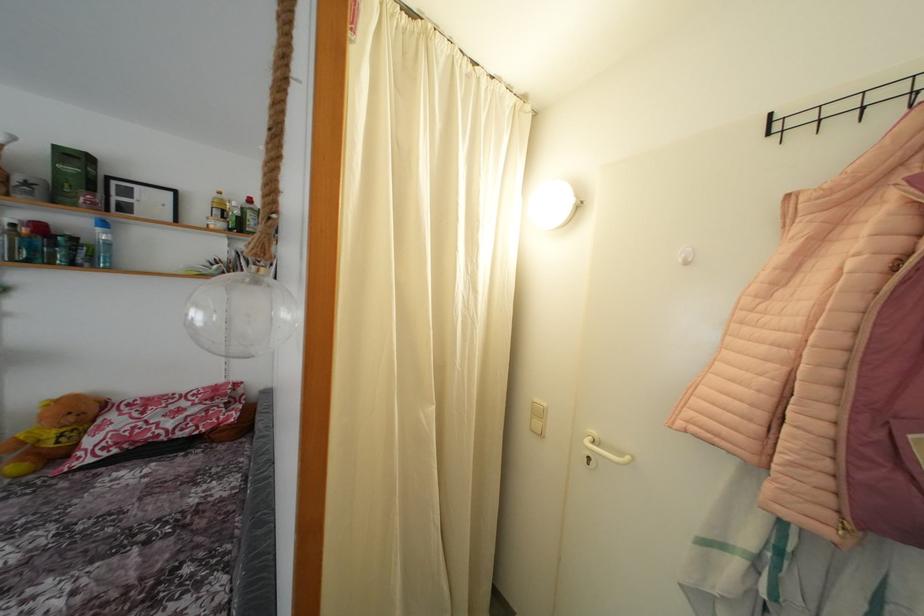
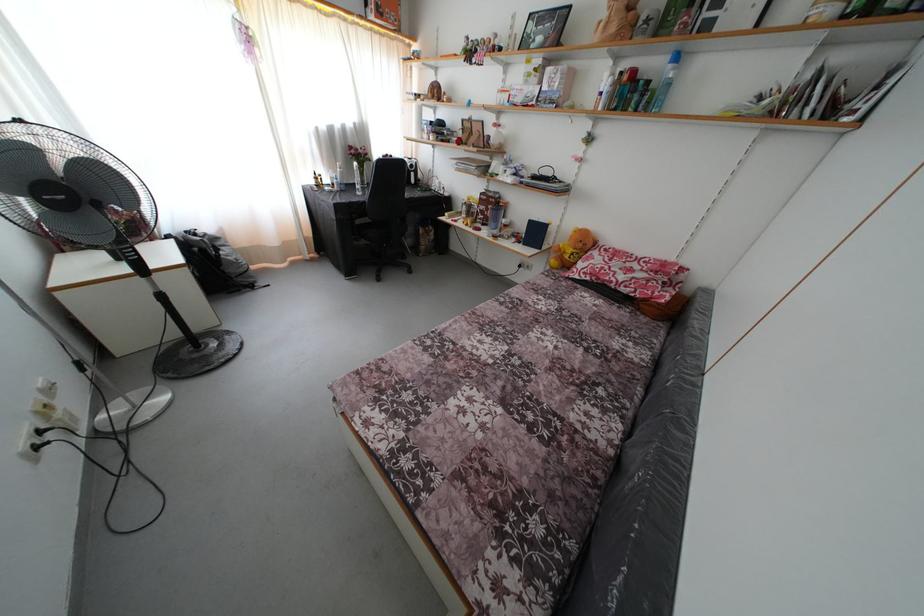
Find the pixel in the second image that matches the point at 77,424 in the first image.

(585, 251)